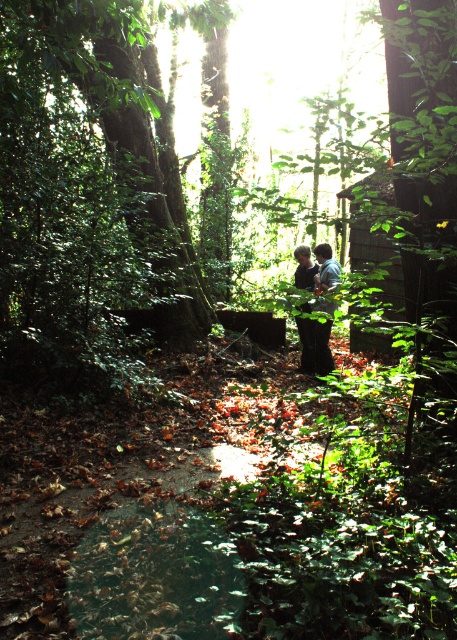
You are a photographer trying to capture a candid shot of two people in the forest. The subjects are wearing a black matte dress at center and dark blue jeans at center. If your camera has a maximum focus range of 10 inches, can you take a clear photo of both subjects at the same time?

The distance between the black matte dress at center and dark blue jeans at center is 9.88 inches, which is within the camera maximum focus range of 10 inches. Therefore, you can take a clear photo of both subjects at the same time.

You are standing in the forest and want to take a photo of the green leafy tree at center. If you move 0.1 units to the right along the x axis, will you be closer to the tree?

The green leafy tree at center is located at point (90, 170). Moving 0.1 units to the right along the x axis would increase your x coordinate, so you would be moving away from the tree along the x axis. Therefore, you would not be closer to the tree.

You are standing at the edge of a forest clearing and see a point marked at coordinates (90, 170). Based on the scene description, what object does this coordinate point to?

The point at coordinates (90, 170) corresponds to the green leafy tree at center.